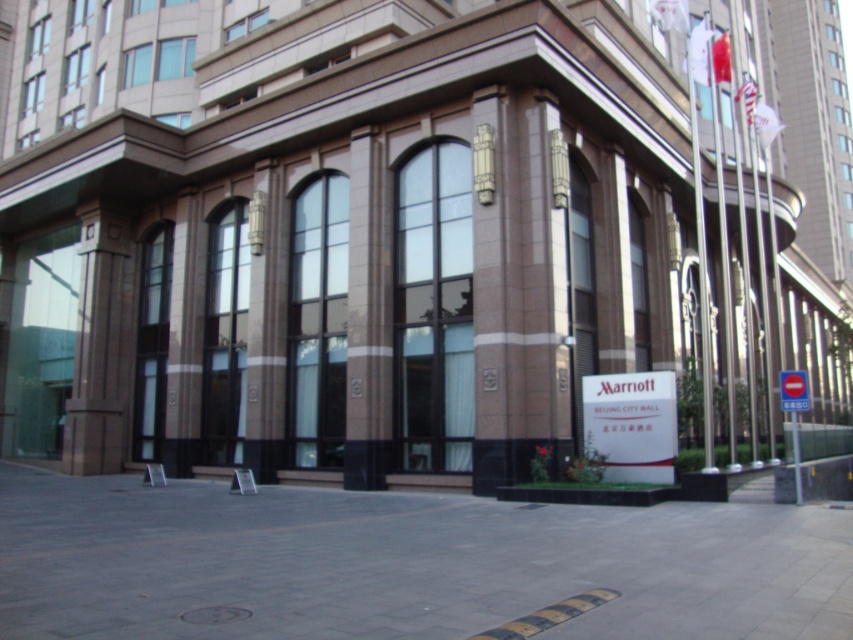
Question: Among these points, which one is farthest from the camera?

Choices:
 (A) (209, 536)
 (B) (799, 406)
 (C) (605, 461)
 (D) (352, 236)

Answer: (D)

Question: Does gray concrete pavement at center appear under white paper sign at lower right?

Choices:
 (A) yes
 (B) no

Answer: (A)

Question: Observing the image, what is the correct spatial positioning of white paper sign at lower right in reference to white plastic sign at center right?

Choices:
 (A) above
 (B) below

Answer: (A)

Question: Which point is farther to the camera?

Choices:
 (A) (132, 573)
 (B) (631, 468)
 (C) (805, 406)
 (D) (383, 429)

Answer: (D)

Question: Among these objects, which one is nearest to the camera?

Choices:
 (A) brown stone column at center
 (B) gray concrete pavement at center

Answer: (B)

Question: Does gray concrete pavement at center have a lesser width compared to brown stone column at center?

Choices:
 (A) yes
 (B) no

Answer: (B)